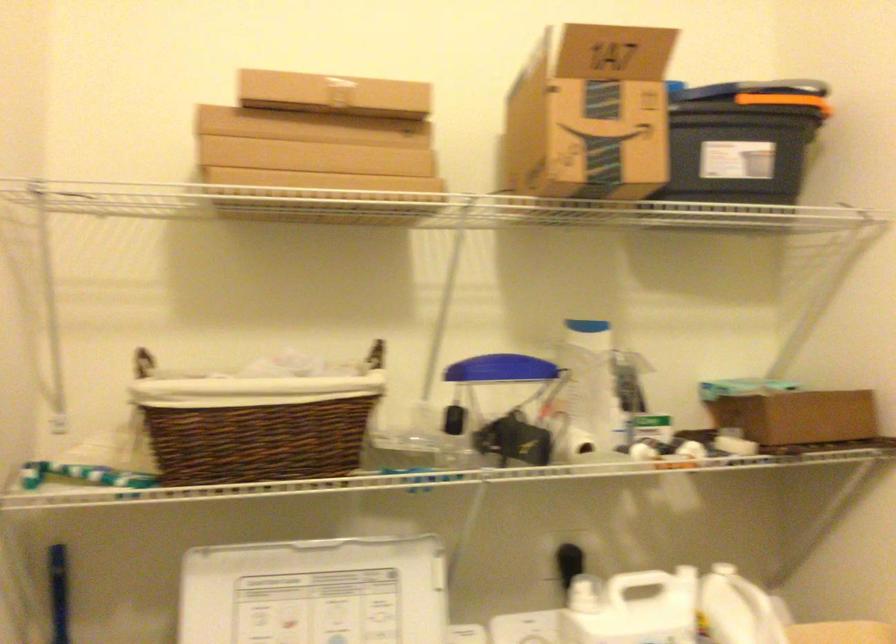
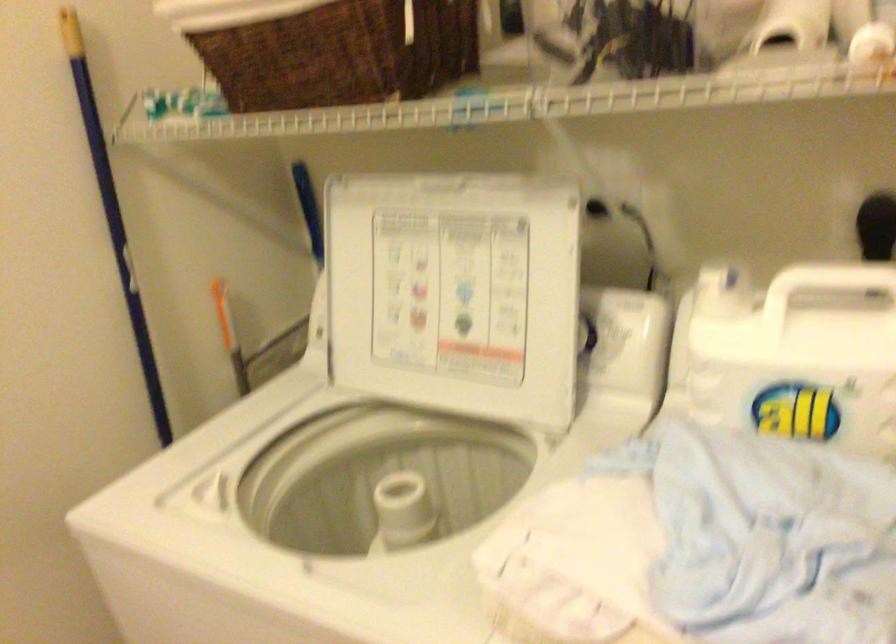
First-person continuous shooting, in which direction is the camera rotating?

The rotation direction of the camera is left-down.